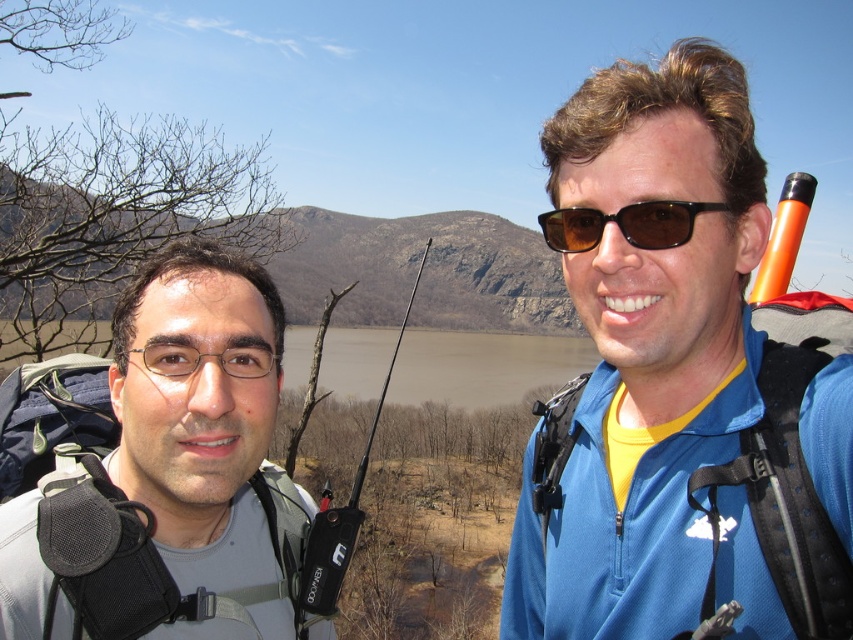
Is blue fabric jacket at center wider than brown matte sunglasses at upper right?

Yes, blue fabric jacket at center is wider than brown matte sunglasses at upper right.

Who is shorter, blue fabric jacket at center or brown matte sunglasses at upper right?

With less height is brown matte sunglasses at upper right.

Which is behind, point (535, 493) or point (579, 209)?

Point (535, 493)

At what (x,y) coordinates should I click in order to perform the action: click on blue fabric jacket at center. Please return your answer as a coordinate pair (x, y). Looking at the image, I should click on (677, 387).

The width and height of the screenshot is (853, 640). Identify the location of gray fabric backpack at left. (155, 468).

Does gray fabric backpack at left have a lesser height compared to brown matte sunglasses at upper right?

In fact, gray fabric backpack at left may be taller than brown matte sunglasses at upper right.

Who is more distant from viewer, (x=224, y=560) or (x=581, y=236)?

The point (x=581, y=236) is behind.

The height and width of the screenshot is (640, 853). In order to click on gray fabric backpack at left in this screenshot , I will do `click(155, 468)`.

Does blue fabric jacket at center have a greater width compared to gray fabric backpack at left?

In fact, blue fabric jacket at center might be narrower than gray fabric backpack at left.

Who is lower down, blue fabric jacket at center or gray fabric backpack at left?

Positioned lower is gray fabric backpack at left.

Which is behind, point (668, 618) or point (26, 628)?

Point (668, 618)

The width and height of the screenshot is (853, 640). Identify the location of blue fabric jacket at center. (677, 387).